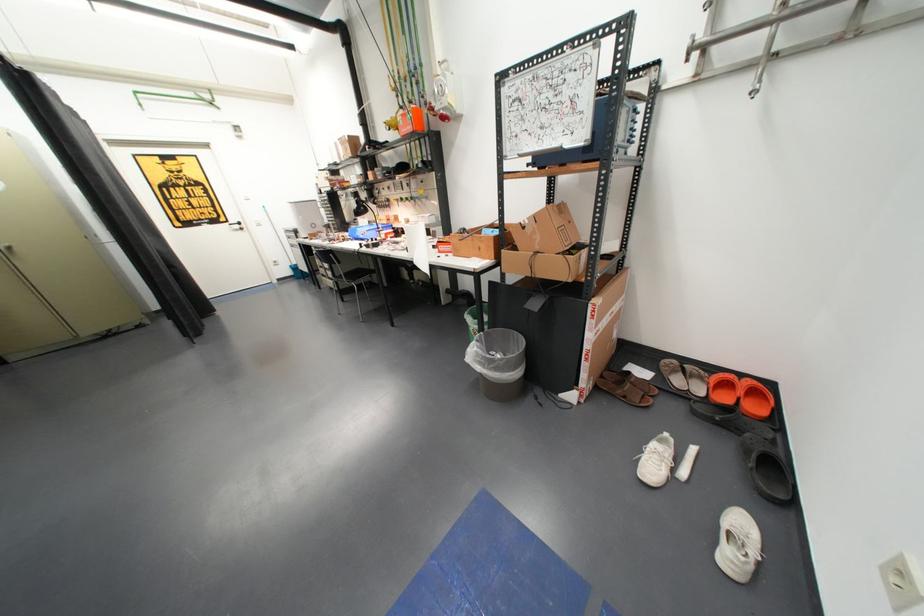
Identify the location of black chair sitting surface. The width and height of the screenshot is (924, 616). (343, 275).